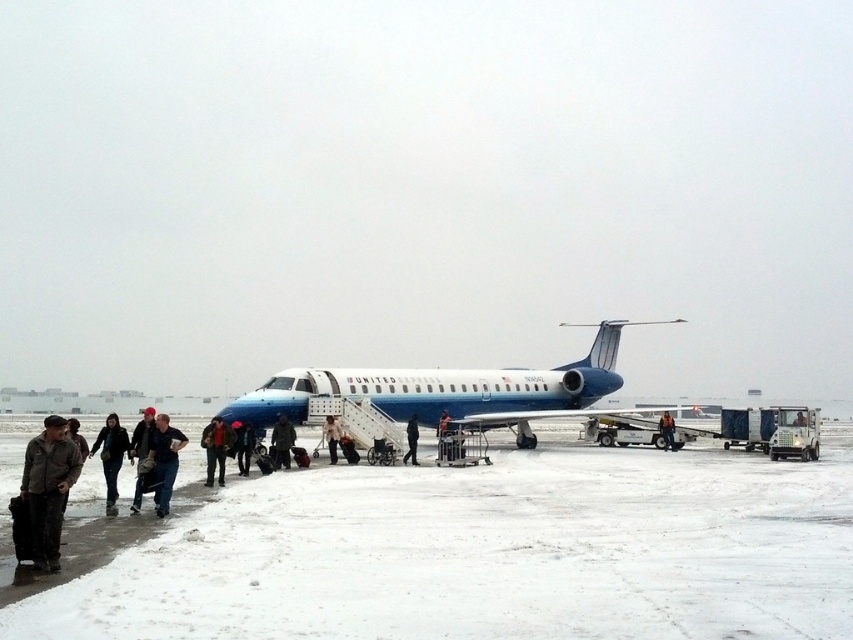
You are a passenger with a 1.2 meter wide luggage cart. You want to move from the dark blue jeans at lower center to the dark blue uniform at center. Can your cart fit through the space between them?

The distance between dark blue jeans at lower center and dark blue uniform at center is 14.25 meters, which is more than enough for your 1.2 meter wide luggage cart to pass through comfortably.

You are an airport security officer observing passengers boarding the United Airlines regional jet. You notice a passenger wearing a dark gray fabric jacket at center and dark blue jeans at center. Based on their clothing, can you determine if the jacket is covering the jeans?

The dark gray fabric jacket at center is positioned over dark blue jeans at center, so yes, the jacket is covering the jeans.

Based on the photo, you are a passenger at the snowy airport tarmac. You see two people in dark clothing. One is wearing dark blue jeans at lower center and the other is wearing dark blue uniform at center. Which person is standing closer to the airplane stairs?

The dark blue jeans at lower center is located above dark blue uniform at center, so the person wearing dark blue jeans at lower center is closer to the airplane stairs since they are positioned higher up in the image.